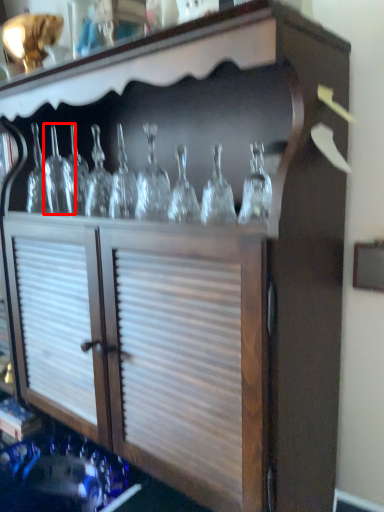
Question: In this image, where is glass bottle (annotated by the red box) located relative to glass bottle?

Choices:
 (A) left
 (B) right

Answer: (A)